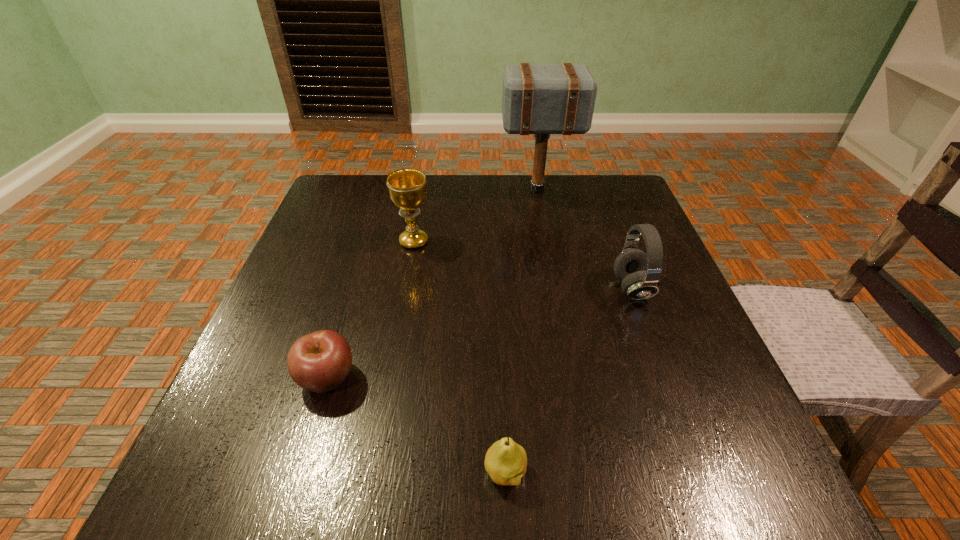
At what (x,y) coordinates should I click in order to perform the action: click on free location at the far right corner. Please return your answer as a coordinate pair (x, y). Image resolution: width=960 pixels, height=540 pixels. Looking at the image, I should click on (579, 178).

Identify the location of free space between the apple and the headset. The height and width of the screenshot is (540, 960). (480, 333).

I want to click on empty location between the fourth object from right to left and the farthest object, so click(x=476, y=215).

This screenshot has width=960, height=540. Identify the location of unoccupied position between the second farthest object and the pear. coord(460,357).

Locate an element on the screen. The width and height of the screenshot is (960, 540). unoccupied area between the nearest object and the farthest object is located at coordinates (521, 331).

Image resolution: width=960 pixels, height=540 pixels. Identify the location of empty space between the pear and the farthest object. (521, 331).

Where is `blank region between the nearest object and the headset`? This screenshot has width=960, height=540. blank region between the nearest object and the headset is located at coordinates (568, 380).

Locate an element on the screen. The image size is (960, 540). vacant point located between the tallest object and the rightmost object is located at coordinates (585, 239).

Image resolution: width=960 pixels, height=540 pixels. I want to click on free space between the leftmost object and the headset, so click(x=480, y=333).

At what (x,y) coordinates should I click in order to perform the action: click on vacant space that is in between the pear and the apple. Please return your answer as a coordinate pair (x, y). The width and height of the screenshot is (960, 540). Looking at the image, I should click on (417, 425).